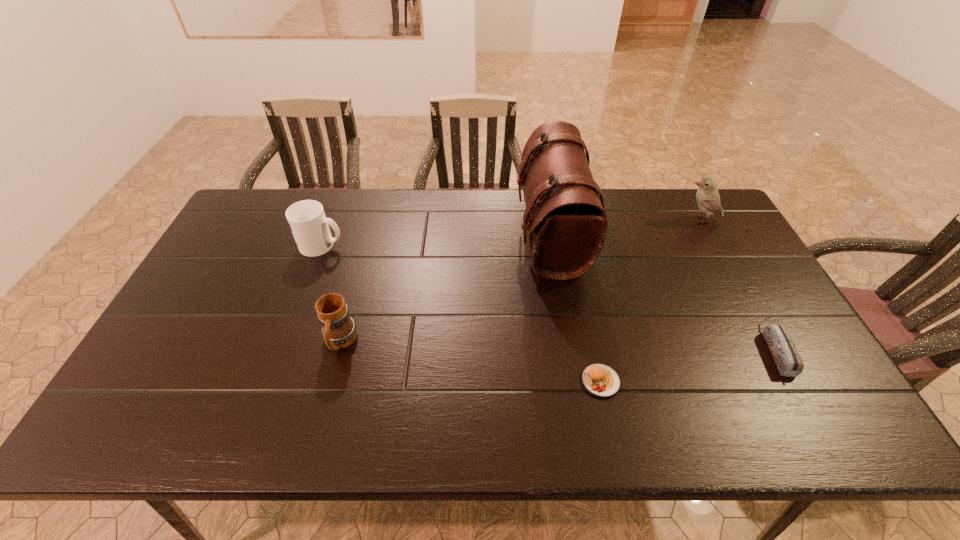
This screenshot has width=960, height=540. In order to click on free location located on the front-facing side of the satchel in this screenshot , I will do `click(399, 234)`.

Image resolution: width=960 pixels, height=540 pixels. I want to click on free space located at the face of the bird, so click(x=572, y=220).

Find the location of a particular element. vacant area situated at the face of the bird is located at coordinates (631, 220).

At what (x,y) coordinates should I click in order to perform the action: click on vacant area situated at the face of the bird. Please return your answer as a coordinate pair (x, y). Image resolution: width=960 pixels, height=540 pixels. Looking at the image, I should click on (663, 220).

Identify the location of free spot located 0.150m on the handle side of the farther mug. (392, 245).

Where is `vacant space situated 0.090m on the side of the fifth object from right to left with the handle`? The height and width of the screenshot is (540, 960). vacant space situated 0.090m on the side of the fifth object from right to left with the handle is located at coordinates [x=325, y=395].

Where is `free space located 0.330m on the back of the pencil box`? The image size is (960, 540). free space located 0.330m on the back of the pencil box is located at coordinates (715, 241).

Where is `vacant space located 0.350m on the left of the patty`? The height and width of the screenshot is (540, 960). vacant space located 0.350m on the left of the patty is located at coordinates (436, 381).

Locate an element on the screen. The height and width of the screenshot is (540, 960). satchel that is at the far edge is located at coordinates (565, 217).

The height and width of the screenshot is (540, 960). In order to click on bird at the far edge in this screenshot , I will do `click(708, 199)`.